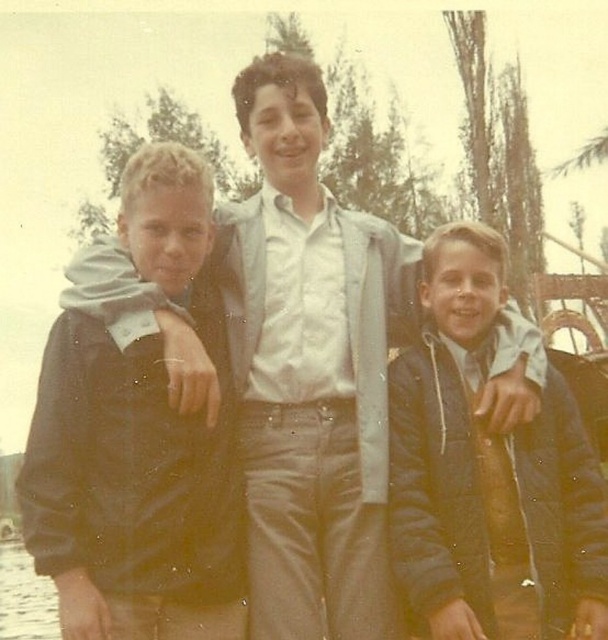
In the scene shown: Can you confirm if dark brown leather jacket at left is smaller than dark blue jacket at center?

Incorrect, dark brown leather jacket at left is not smaller in size than dark blue jacket at center.

Is dark brown leather jacket at left positioned behind dark blue jacket at center?

No, it is in front of dark blue jacket at center.

Which is in front, point (207, 480) or point (485, 579)?

Point (485, 579)

Identify the location of dark brown leather jacket at left. This screenshot has width=608, height=640. (128, 496).

Can you confirm if dark blue jacket at center is positioned below clear water at lower left?

Actually, dark blue jacket at center is above clear water at lower left.

Is point (545, 532) positioned behind point (15, 627)?

No, it is not.

Between point (396, 504) and point (43, 602), which one is positioned in front?

Point (396, 504) is more forward.

Image resolution: width=608 pixels, height=640 pixels. Identify the location of dark blue jacket at center. (446, 436).

Is point (94, 426) in front of point (16, 612)?

Yes, it is.

Does point (206, 202) come closer to viewer compared to point (12, 564)?

Yes.

The height and width of the screenshot is (640, 608). Identify the location of dark brown leather jacket at left. (128, 496).